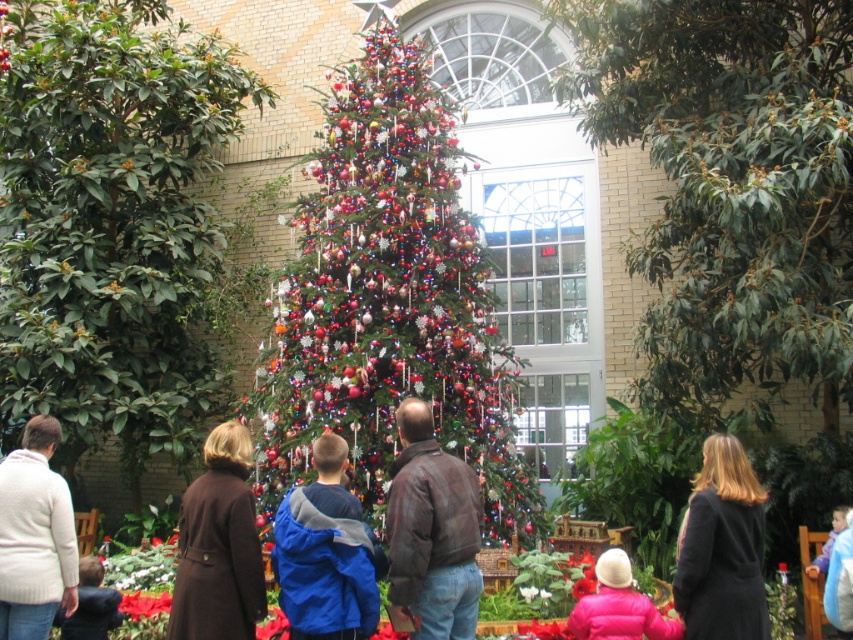
Question: Does blue fleece jacket at center lie behind brown wool coat at center?

Choices:
 (A) no
 (B) yes

Answer: (A)

Question: Which object is positioned closest to the brown leather jacket at center?

Choices:
 (A) knit white sweater at lower left
 (B) green leafy tree at center
 (C) brown wool coat at center
 (D) blue fleece jacket at center

Answer: (D)

Question: Which object is farther from the camera taking this photo?

Choices:
 (A) shiny green christmas tree at center
 (B) pink matte jacket at lower center
 (C) dark wool coat at center

Answer: (A)

Question: From the image, what is the correct spatial relationship of shiny green christmas tree at center in relation to dark blue jacket at lower left?

Choices:
 (A) right
 (B) left

Answer: (A)

Question: Considering the relative positions of knit white sweater at lower left and dark blue jacket at lower left in the image provided, where is knit white sweater at lower left located with respect to dark blue jacket at lower left?

Choices:
 (A) right
 (B) left

Answer: (B)

Question: Estimate the real-world distances between objects in this image. Which object is farther from the knit white sweater at lower left?

Choices:
 (A) dark blue jacket at lower left
 (B) pink matte jacket at lower center

Answer: (B)